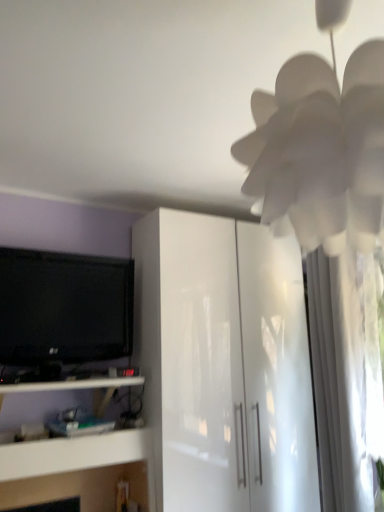
Where is `white sheer curtain at right`? white sheer curtain at right is located at coordinates (345, 376).

In order to face white sheer curtain at right, should I rotate leftwards or rightwards?

It's best to rotate right around 18.660 degrees.

This screenshot has width=384, height=512. What do you see at coordinates (321, 143) in the screenshot?
I see `white paper flower at upper right` at bounding box center [321, 143].

Image resolution: width=384 pixels, height=512 pixels. I want to click on white sheer curtain at right, so click(x=345, y=376).

How many degrees apart are the facing directions of white glossy shelf at lower left and white sheer curtain at right?

The facing directions of white glossy shelf at lower left and white sheer curtain at right are 90.6 degrees apart.

Can white sheer curtain at right be found inside white glossy shelf at lower left?

No, white sheer curtain at right is not a part of white glossy shelf at lower left.

Is white glossy shelf at lower left taller or shorter than white sheer curtain at right?

white glossy shelf at lower left is shorter than white sheer curtain at right.

Is white glossy shelf at lower left wider than white sheer curtain at right?

Correct, the width of white glossy shelf at lower left exceeds that of white sheer curtain at right.

Is white paper flower at upper right outside of white sheer curtain at right?

Yes, white paper flower at upper right is located beyond the bounds of white sheer curtain at right.

From the image's perspective, which object appears higher, white paper flower at upper right or white sheer curtain at right?

white paper flower at upper right, from the image's perspective.

Is white paper flower at upper right wider than white sheer curtain at right?

Correct, the width of white paper flower at upper right exceeds that of white sheer curtain at right.

From the image's perspective, would you say white sheer curtain at right is shown under glossy white cabinet at center?

No.

Based on the photo, considering the sizes of objects white sheer curtain at right and glossy white cabinet at center in the image provided, who is shorter, white sheer curtain at right or glossy white cabinet at center?

With less height is white sheer curtain at right.

How many degrees apart are the facing directions of white sheer curtain at right and glossy white cabinet at center?

white sheer curtain at right and glossy white cabinet at center are facing 90 degrees away from each other.

Could you tell me if white sheer curtain at right is turned towards glossy white cabinet at center?

No, white sheer curtain at right is not aimed at glossy white cabinet at center.

Does point (99, 379) lie behind point (112, 262)?

No, (99, 379) is in front of (112, 262).

Would you say white glossy shelf at lower left is a long distance from black glossy tv at left?

No, white glossy shelf at lower left is in close proximity to black glossy tv at left.

From a real-world perspective, which object stands above the other?

black glossy tv at left is physically above.

From the image's perspective, relative to black glossy tv at left, is white glossy shelf at lower left above or below?

Clearly, from the image's perspective, white glossy shelf at lower left is below black glossy tv at left.

Could white sheer curtain at right be considered to be inside glossy white cabinet at center?

No, white sheer curtain at right is not a part of glossy white cabinet at center.

Is glossy white cabinet at center facing towards white sheer curtain at right?

Yes, glossy white cabinet at center is facing white sheer curtain at right.

What's the angular difference between glossy white cabinet at center and white sheer curtain at right's facing directions?

There is a 90-degree angle between the facing directions of glossy white cabinet at center and white sheer curtain at right.

From a real-world perspective, is glossy white cabinet at center positioned above or below white paper flower at upper right?

glossy white cabinet at center is below white paper flower at upper right.

Looking at this image, which object is closer to the camera, glossy white cabinet at center or white paper flower at upper right?

white paper flower at upper right is closer to the camera.

Between point (248, 377) and point (311, 182), which one is positioned in front?

The point (311, 182) is in front.

Is glossy white cabinet at center facing towards white paper flower at upper right?

Yes, glossy white cabinet at center is oriented towards white paper flower at upper right.

Does point (119, 378) appear closer or farther from the camera than point (244, 296)?

Point (119, 378) appears to be closer to the viewer than point (244, 296).

From the image's perspective, is white glossy shelf at lower left on top of glossy white cabinet at center?

Actually, white glossy shelf at lower left appears below glossy white cabinet at center in the image.

Considering the relative positions of white glossy shelf at lower left and glossy white cabinet at center in the image provided, is white glossy shelf at lower left behind glossy white cabinet at center?

No, white glossy shelf at lower left is closer to the camera.

I want to click on shelf located on the left of white sheer curtain at right, so click(x=75, y=387).

You are a GUI agent. You are given a task and a screenshot of the screen. Output one action in this format:
    pyautogui.click(x=<x>, y=<y>)
    Task: Click on the curtain below the white paper flower at upper right (from a real-world perspective)
    
    Given the screenshot: What is the action you would take?
    pyautogui.click(x=345, y=376)

Based on their spatial positions, is white sheer curtain at right or glossy white cabinet at center closer to black glossy tv at left?

glossy white cabinet at center is closer to black glossy tv at left.

Looking at the image, which one is located closer to white glossy shelf at lower left, black glossy tv at left or white sheer curtain at right?

black glossy tv at left is positioned closer to the anchor white glossy shelf at lower left.

From the image, which object appears to be nearer to glossy white cabinet at center, black glossy tv at left or white glossy shelf at lower left?

Based on the image, black glossy tv at left appears to be nearer to glossy white cabinet at center.

Considering their positions, is white glossy shelf at lower left positioned further to glossy white cabinet at center than white paper flower at upper right?

Among the two, white paper flower at upper right is located further to glossy white cabinet at center.

Looking at the image, which one is located further to white paper flower at upper right, white glossy shelf at lower left or white sheer curtain at right?

white glossy shelf at lower left.

From the image, which object appears to be nearer to white paper flower at upper right, glossy white cabinet at center or white sheer curtain at right?

white sheer curtain at right.

Considering their positions, is glossy white cabinet at center positioned closer to white sheer curtain at right than white glossy shelf at lower left?

Among the two, glossy white cabinet at center is located nearer to white sheer curtain at right.

Looking at the image, which one is located closer to glossy white cabinet at center, white paper flower at upper right or white sheer curtain at right?

Based on the image, white sheer curtain at right appears to be nearer to glossy white cabinet at center.

Find the location of a particular element. The height and width of the screenshot is (512, 384). television between white paper flower at upper right and white sheer curtain at right from front to back is located at coordinates (63, 309).

Locate an element on the screen. This screenshot has height=512, width=384. shelf between black glossy tv at left and glossy white cabinet at center in the horizontal direction is located at coordinates (75, 387).

At what (x,y) coordinates should I click in order to perform the action: click on cabinetry located between white paper flower at upper right and black glossy tv at left in the depth direction. Please return your answer as a coordinate pair (x, y). The width and height of the screenshot is (384, 512). Looking at the image, I should click on (224, 364).

Identify the location of shelf located between white paper flower at upper right and glossy white cabinet at center in the depth direction. The image size is (384, 512). (75, 387).